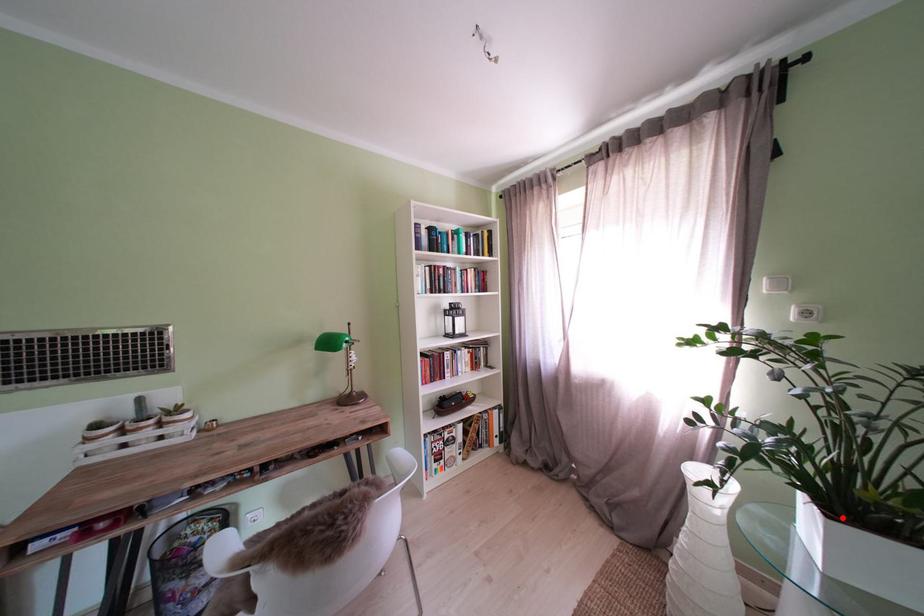
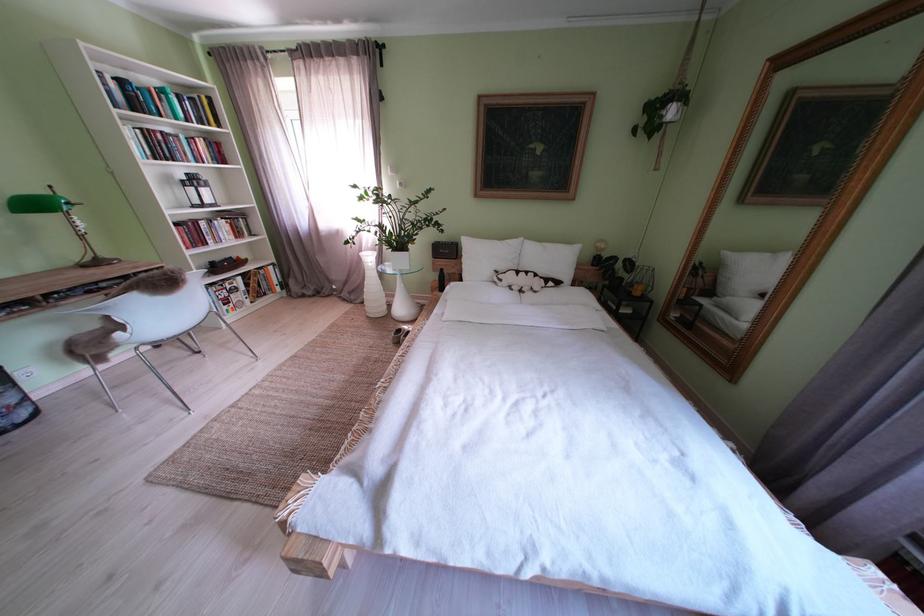
Question: I am providing you with two images of the same scene from different viewpoints. A red point is shown in image1. For the corresponding object point in image2, is it positioned nearer or farther from the camera?

Choices:
 (A) Nearer
 (B) Farther

Answer: (B)